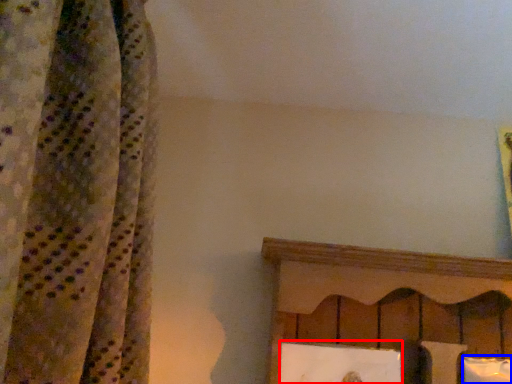
Question: Which point is closer to the camera, picture frame (highlighted by a red box) or pillow (highlighted by a blue box)?

Choices:
 (A) picture frame
 (B) pillow

Answer: (A)